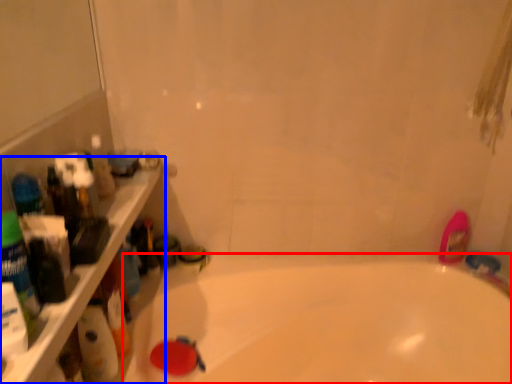
Question: Among these objects, which one is nearest to the camera, bathtub (highlighted by a red box) or ledge (highlighted by a blue box)?

Choices:
 (A) bathtub
 (B) ledge

Answer: (B)